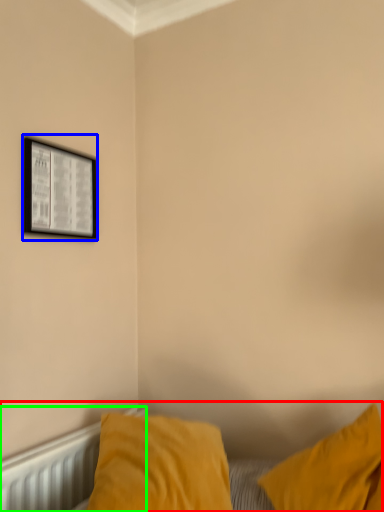
Question: Considering the real-world distances, which object is closest to bed (highlighted by a red box)? picture frame (highlighted by a blue box) or radiator (highlighted by a green box).

Choices:
 (A) picture frame
 (B) radiator

Answer: (B)